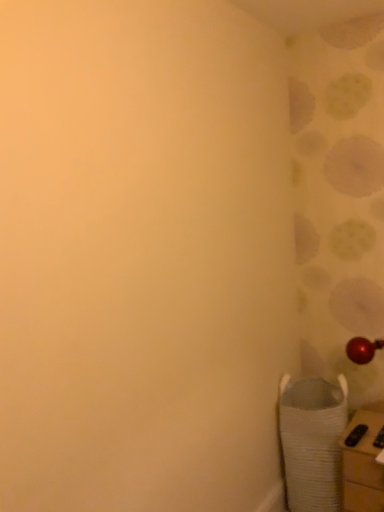
What is the approximate height of white cardboard box at lower right?

It is 48.00 centimeters.

Locate an element on the screen. This screenshot has height=512, width=384. white cardboard box at lower right is located at coordinates tap(363, 466).

The width and height of the screenshot is (384, 512). What do you see at coordinates (363, 466) in the screenshot?
I see `white cardboard box at lower right` at bounding box center [363, 466].

This screenshot has height=512, width=384. What do you see at coordinates (312, 442) in the screenshot?
I see `white woven laundry basket at lower right` at bounding box center [312, 442].

Locate an element on the screen. This screenshot has height=512, width=384. white woven laundry basket at lower right is located at coordinates (312, 442).

Identify the location of white cardboard box at lower right. (363, 466).

Based on the photo, which is more to the left, white woven laundry basket at lower right or white cardboard box at lower right?

white woven laundry basket at lower right.

Considering the relative positions of white woven laundry basket at lower right and white cardboard box at lower right in the image provided, is white woven laundry basket at lower right behind white cardboard box at lower right?

Yes, the depth of white woven laundry basket at lower right is greater than that of white cardboard box at lower right.

Considering the positions of points (331, 471) and (355, 508), is point (331, 471) closer to camera compared to point (355, 508)?

No, (331, 471) is behind (355, 508).

From the image's perspective, which one is positioned lower, white woven laundry basket at lower right or white cardboard box at lower right?

From the image's view, white cardboard box at lower right is below.

From a real-world perspective, does white woven laundry basket at lower right stand above white cardboard box at lower right?

Yes, from a real-world perspective, white woven laundry basket at lower right is on top of white cardboard box at lower right.

Considering the sizes of objects white woven laundry basket at lower right and white cardboard box at lower right in the image provided, who is thinner, white woven laundry basket at lower right or white cardboard box at lower right?

Thinner between the two is white cardboard box at lower right.

Can you confirm if white woven laundry basket at lower right is shorter than white cardboard box at lower right?

No, white woven laundry basket at lower right is not shorter than white cardboard box at lower right.

Considering the sizes of objects white woven laundry basket at lower right and white cardboard box at lower right in the image provided, who is smaller, white woven laundry basket at lower right or white cardboard box at lower right?

Smaller between the two is white cardboard box at lower right.

Can we say white woven laundry basket at lower right lies outside white cardboard box at lower right?

Yes, white woven laundry basket at lower right is outside of white cardboard box at lower right.

Is white woven laundry basket at lower right beside white cardboard box at lower right?

white woven laundry basket at lower right and white cardboard box at lower right are clearly separated.

Is white cardboard box at lower right at the back of white woven laundry basket at lower right?

white woven laundry basket at lower right is not turned away from white cardboard box at lower right.

Can you tell me how much white woven laundry basket at lower right and white cardboard box at lower right differ in facing direction?

There is a 1.62-degree angle between the facing directions of white woven laundry basket at lower right and white cardboard box at lower right.

How much distance is there between white woven laundry basket at lower right and white cardboard box at lower right?

white woven laundry basket at lower right and white cardboard box at lower right are 6.35 inches apart from each other.

The width and height of the screenshot is (384, 512). Identify the location of laundry basket on the left of white cardboard box at lower right. (312, 442).

Is white cardboard box at lower right to the left of white woven laundry basket at lower right from the viewer's perspective?

No.

Which object is further away from the camera, white cardboard box at lower right or white woven laundry basket at lower right?

white woven laundry basket at lower right is further away from the camera.

Which is in front, point (379, 420) or point (317, 379)?

The point (379, 420) is closer.

From the image's perspective, who appears lower, white cardboard box at lower right or white woven laundry basket at lower right?

white cardboard box at lower right is shown below in the image.

From a real-world perspective, between white cardboard box at lower right and white woven laundry basket at lower right, who is vertically lower?

In real-world perspective, white cardboard box at lower right is lower.

Considering the sizes of white cardboard box at lower right and white woven laundry basket at lower right in the image, is white cardboard box at lower right wider or thinner than white woven laundry basket at lower right?

In the image, white cardboard box at lower right appears to be more narrow than white woven laundry basket at lower right.

Who is shorter, white cardboard box at lower right or white woven laundry basket at lower right?

white cardboard box at lower right.

Who is bigger, white cardboard box at lower right or white woven laundry basket at lower right?

white woven laundry basket at lower right is bigger.

Is white woven laundry basket at lower right surrounded by white cardboard box at lower right?

Actually, white woven laundry basket at lower right is outside white cardboard box at lower right.

Is white cardboard box at lower right placed right next to white woven laundry basket at lower right?

There is a gap between white cardboard box at lower right and white woven laundry basket at lower right.

Could you tell me if white cardboard box at lower right is turned towards white woven laundry basket at lower right?

No, white cardboard box at lower right does not turn towards white woven laundry basket at lower right.

How different are the orientations of white cardboard box at lower right and white woven laundry basket at lower right in degrees?

The angular difference between white cardboard box at lower right and white woven laundry basket at lower right is 1.62 degrees.

Find the location of a particular element. The image size is (384, 512). furniture in front of the white woven laundry basket at lower right is located at coordinates (363, 466).

Image resolution: width=384 pixels, height=512 pixels. What are the coordinates of `laundry basket above the white cardboard box at lower right (from the image's perspective)` in the screenshot? It's located at (312, 442).

This screenshot has height=512, width=384. Find the location of `laundry basket above the white cardboard box at lower right (from a real-world perspective)`. laundry basket above the white cardboard box at lower right (from a real-world perspective) is located at coordinates (312, 442).